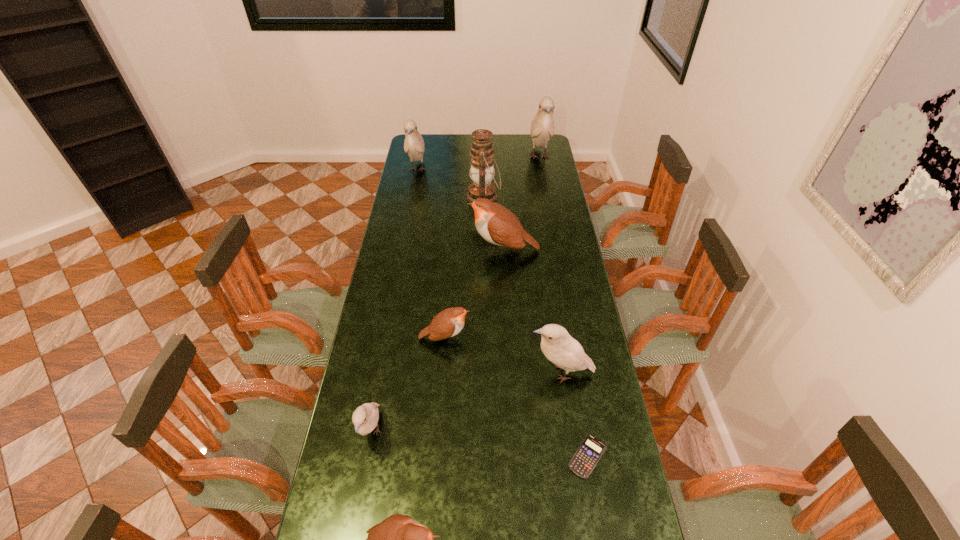
Identify the location of the tallest bird. The height and width of the screenshot is (540, 960). (542, 127).

Locate an element on the screen. lantern is located at coordinates (482, 169).

Where is `the third smallest white bird`? The height and width of the screenshot is (540, 960). the third smallest white bird is located at coordinates (413, 144).

Where is `the farthest brown bird`? The height and width of the screenshot is (540, 960). the farthest brown bird is located at coordinates (495, 223).

At what (x,y) coordinates should I click in order to perform the action: click on the third farthest bird. Please return your answer as a coordinate pair (x, y). Image resolution: width=960 pixels, height=540 pixels. Looking at the image, I should click on 495,223.

Locate an element on the screen. This screenshot has width=960, height=540. the fourth nearest object is located at coordinates (557, 345).

What are the coordinates of `the second nearest white bird` in the screenshot? It's located at (557, 345).

This screenshot has height=540, width=960. In order to click on the nearest white bird in this screenshot , I will do `click(365, 418)`.

This screenshot has height=540, width=960. I want to click on the sixth farthest bird, so click(365, 418).

Locate an element on the screen. This screenshot has height=540, width=960. the fifth farthest object is located at coordinates (449, 322).